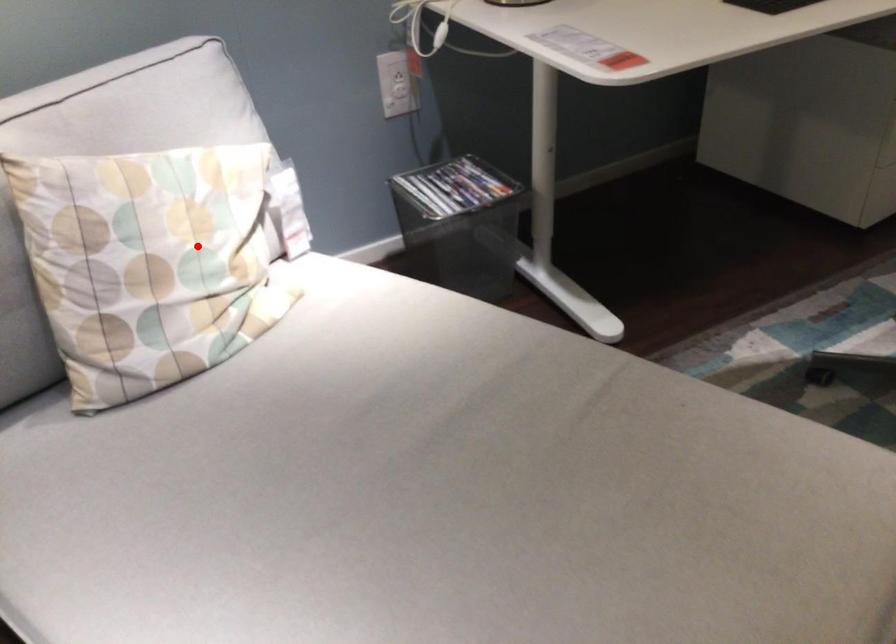
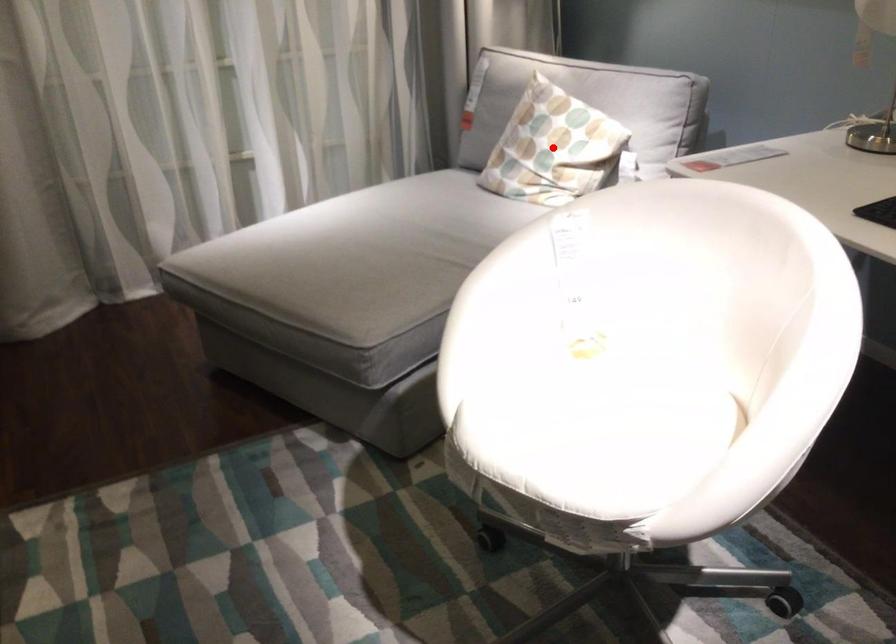
I am providing you with two images of the same scene from different viewpoints. A red point is marked on the first image and another point is marked on the second image. Do the highlighted points in image1 and image2 indicate the same real-world spot?

Yes